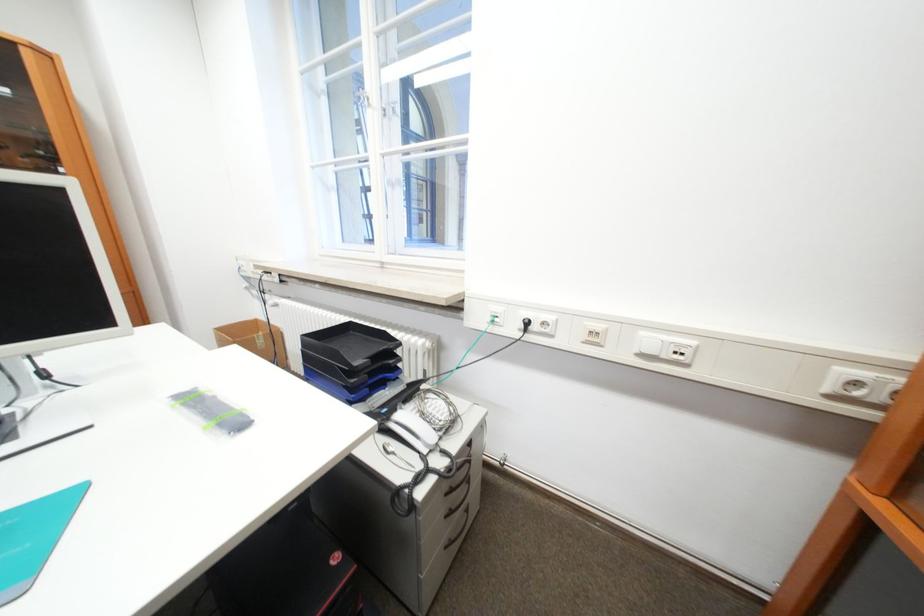
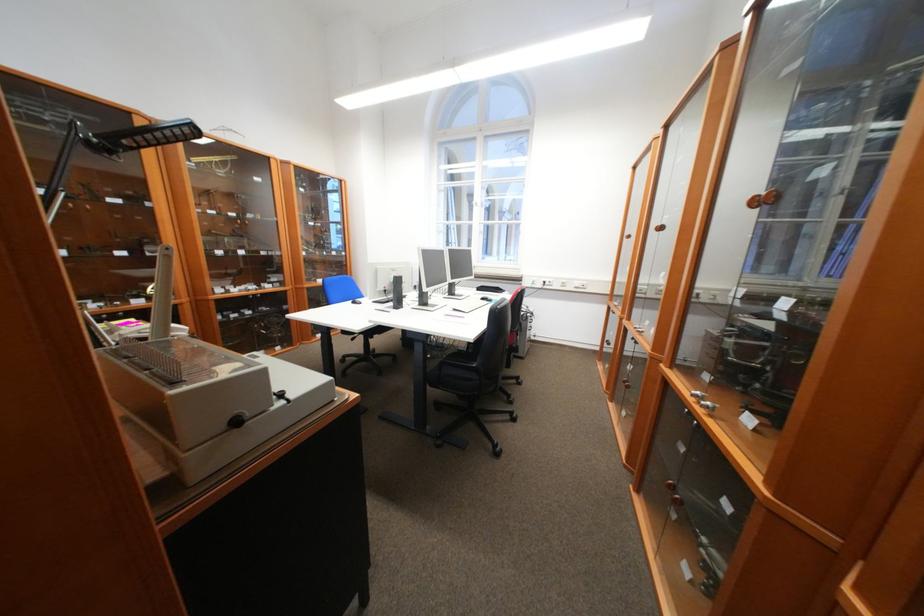
Locate, in the second image, the point that corresponds to (x=531, y=328) in the first image.

(553, 284)